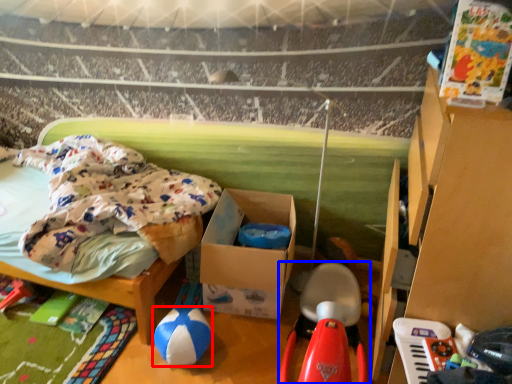
Question: Among these objects, which one is nearest to the camera, toy (highlighted by a red box) or toy (highlighted by a blue box)?

Choices:
 (A) toy
 (B) toy

Answer: (B)